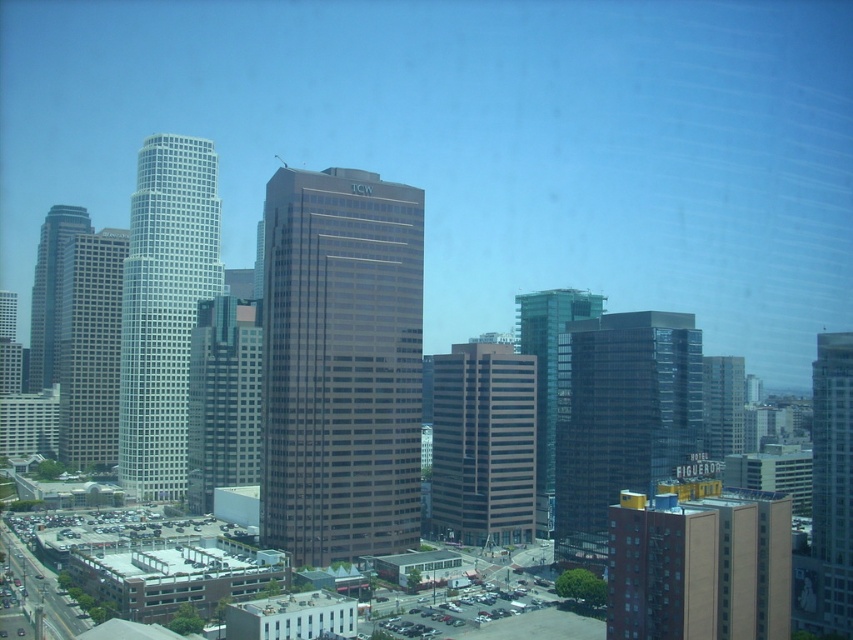
Can you confirm if glassy reflective skyscraper at center-right is smaller than white glass skyscraper at left?

Indeed, glassy reflective skyscraper at center-right has a smaller size compared to white glass skyscraper at left.

Is glassy reflective skyscraper at center-right to the left of white glass skyscraper at left from the viewer's perspective?

In fact, glassy reflective skyscraper at center-right is to the right of white glass skyscraper at left.

Describe the element at coordinates (619, 419) in the screenshot. I see `glassy reflective skyscraper at center-right` at that location.

At what (x,y) coordinates should I click in order to perform the action: click on glassy reflective skyscraper at center-right. Please return your answer as a coordinate pair (x, y). This screenshot has height=640, width=853. Looking at the image, I should click on (619, 419).

Consider the image. Is white glass skyscraper at center-left bigger than glassy reflective skyscraper at center-left?

Indeed, white glass skyscraper at center-left has a larger size compared to glassy reflective skyscraper at center-left.

Is white glass skyscraper at center-left wider than glassy reflective skyscraper at center-left?

Yes.

Locate an element on the screen. white glass skyscraper at center-left is located at coordinates point(164,308).

Based on the photo, can you confirm if brown brick building at lower right is positioned to the right of white glass skyscraper at center-right?

Incorrect, brown brick building at lower right is not on the right side of white glass skyscraper at center-right.

Who is taller, brown brick building at lower right or white glass skyscraper at center-right?

white glass skyscraper at center-right

Between point (729, 561) and point (827, 444), which one is positioned in front?

Point (729, 561) is more forward.

Locate an element on the screen. brown brick building at lower right is located at coordinates (699, 566).